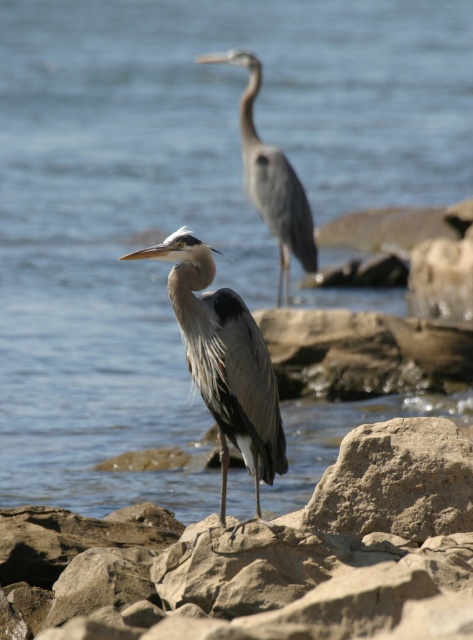
Which is behind, point (397, 465) or point (286, 202)?

The point (286, 202) is behind.

Between point (465, 524) and point (210, 54), which one is positioned behind?

The point (210, 54) is behind.

Identify the location of rough textured rock at center. (396, 481).

Which is more to the right, smooth gray rock at center or gray matte heron at upper center?

From the viewer's perspective, gray matte heron at upper center appears more on the right side.

Is smooth gray rock at center shorter than gray matte heron at upper center?

Correct, smooth gray rock at center is not as tall as gray matte heron at upper center.

Is point (355, 560) more distant than point (301, 216)?

No.

This screenshot has height=640, width=473. I want to click on smooth gray rock at center, so click(265, 556).

Does smooth gray rock at center appear on the right side of gray matte heron at center?

In fact, smooth gray rock at center is to the left of gray matte heron at center.

Who is more forward, (378, 540) or (175, 294)?

Positioned in front is point (175, 294).

What do you see at coordinates (265, 556) in the screenshot? I see `smooth gray rock at center` at bounding box center [265, 556].

At what (x,y) coordinates should I click in order to perform the action: click on smooth gray rock at center. Please return your answer as a coordinate pair (x, y). The width and height of the screenshot is (473, 640). Looking at the image, I should click on pos(265,556).